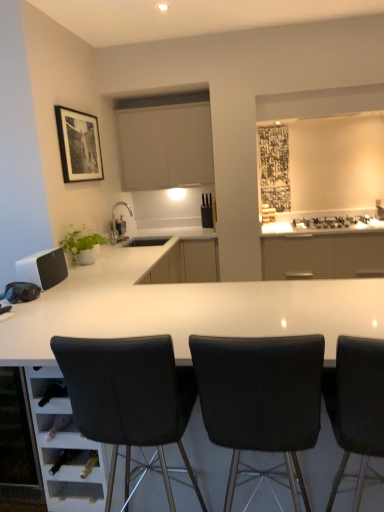
Question: From the image's perspective, does white glossy table at center appear lower than black matte picture frame at upper left?

Choices:
 (A) yes
 (B) no

Answer: (A)

Question: Is white glossy table at center facing away from black matte picture frame at upper left?

Choices:
 (A) no
 (B) yes

Answer: (A)

Question: Considering the relative sizes of white glossy table at center and black matte picture frame at upper left in the image provided, is white glossy table at center wider than black matte picture frame at upper left?

Choices:
 (A) no
 (B) yes

Answer: (B)

Question: Are white glossy table at center and black matte picture frame at upper left making contact?

Choices:
 (A) no
 (B) yes

Answer: (A)

Question: Is white glossy table at center taller than black matte picture frame at upper left?

Choices:
 (A) no
 (B) yes

Answer: (B)

Question: Considering the relative sizes of white glossy table at center and black matte picture frame at upper left in the image provided, is white glossy table at center bigger than black matte picture frame at upper left?

Choices:
 (A) no
 (B) yes

Answer: (B)

Question: Considering the relative sizes of black leather chair at center, which ranks as the first chair in left-to-right order, and black matte picture frame at upper left in the image provided, is black leather chair at center, which ranks as the first chair in left-to-right order, thinner than black matte picture frame at upper left?

Choices:
 (A) no
 (B) yes

Answer: (A)

Question: From the image's perspective, does black leather chair at center, which ranks as the first chair in left-to-right order, appear higher than black matte picture frame at upper left?

Choices:
 (A) yes
 (B) no

Answer: (B)

Question: Does black leather chair at center, which is the 3th chair in right-to-left order, touch black matte picture frame at upper left?

Choices:
 (A) no
 (B) yes

Answer: (A)

Question: Does black leather chair at center, which is the 3th chair in right-to-left order, have a lesser height compared to black matte picture frame at upper left?

Choices:
 (A) yes
 (B) no

Answer: (B)

Question: Is black leather chair at center, which is the 3th chair in right-to-left order, oriented towards black matte picture frame at upper left?

Choices:
 (A) yes
 (B) no

Answer: (B)

Question: Is black leather chair at center, which is the 3th chair in right-to-left order, in front of black matte picture frame at upper left?

Choices:
 (A) no
 (B) yes

Answer: (B)

Question: Is black leather chair at center, which is the 3th chair in right-to-left order, taller than white glossy table at center?

Choices:
 (A) yes
 (B) no

Answer: (A)